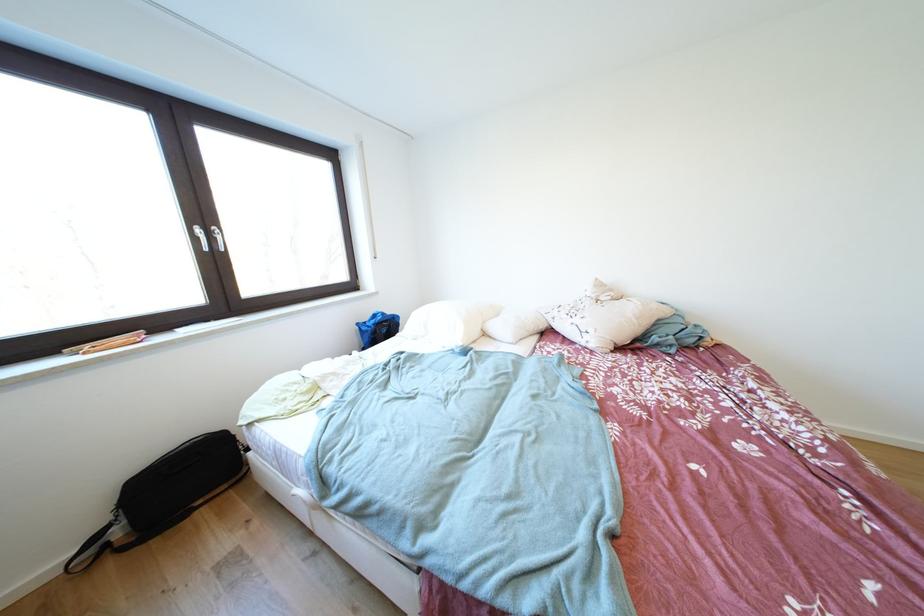
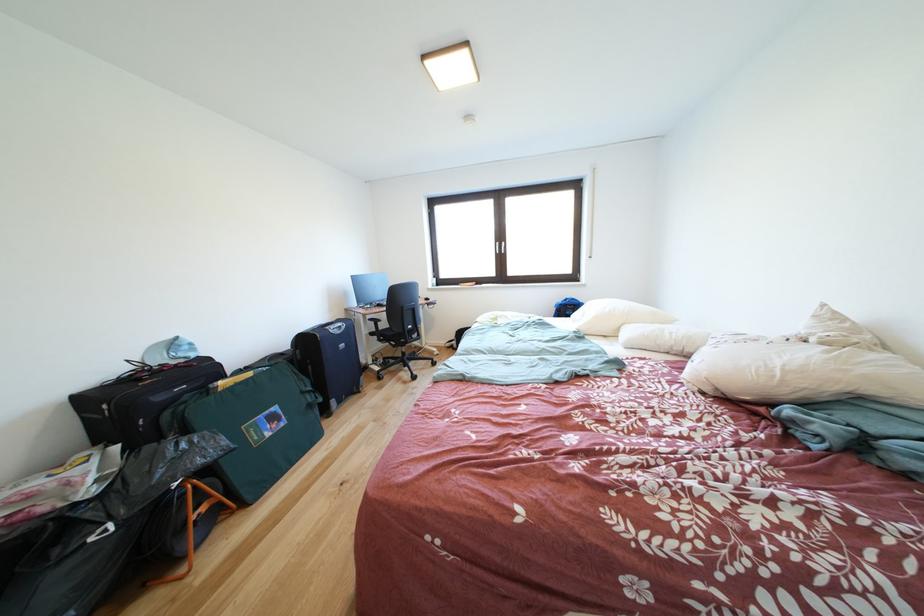
Find the pixel in the second image that matches point (207, 235) in the first image.

(505, 249)